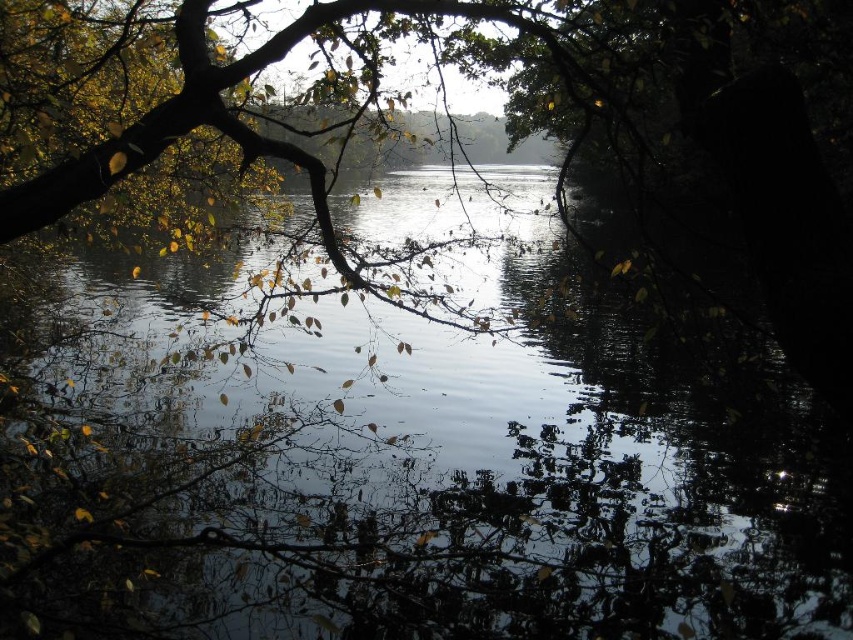
This screenshot has width=853, height=640. I want to click on transparent water at center, so click(463, 461).

Is transparent water at center thinner than green matte leaves at upper left?

Incorrect, transparent water at center's width is not less than green matte leaves at upper left's.

Who is more forward, (379, 406) or (821, 230)?

Point (821, 230) is more forward.

This screenshot has width=853, height=640. What are the coordinates of `transparent water at center` in the screenshot? It's located at (463, 461).